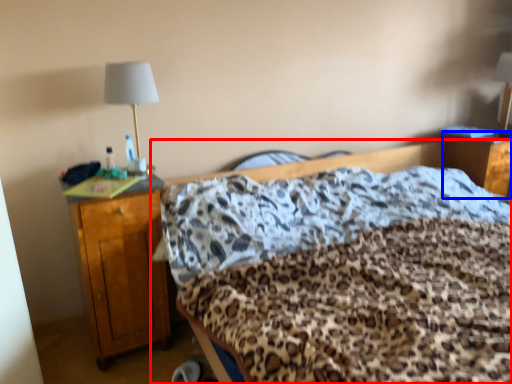
Question: Which object appears farthest to the camera in this image, bed (highlighted by a red box) or nightstand (highlighted by a blue box)?

Choices:
 (A) bed
 (B) nightstand

Answer: (B)